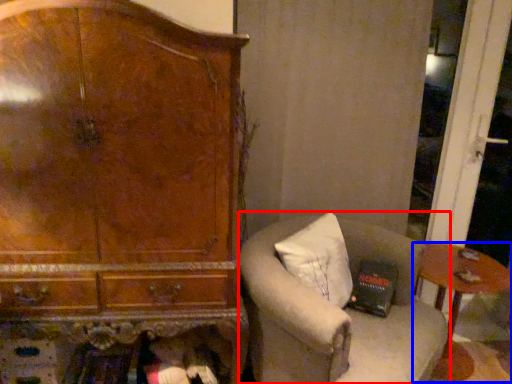
Question: Which point is further to the camera, chair (highlighted by a red box) or table (highlighted by a blue box)?

Choices:
 (A) chair
 (B) table

Answer: (B)